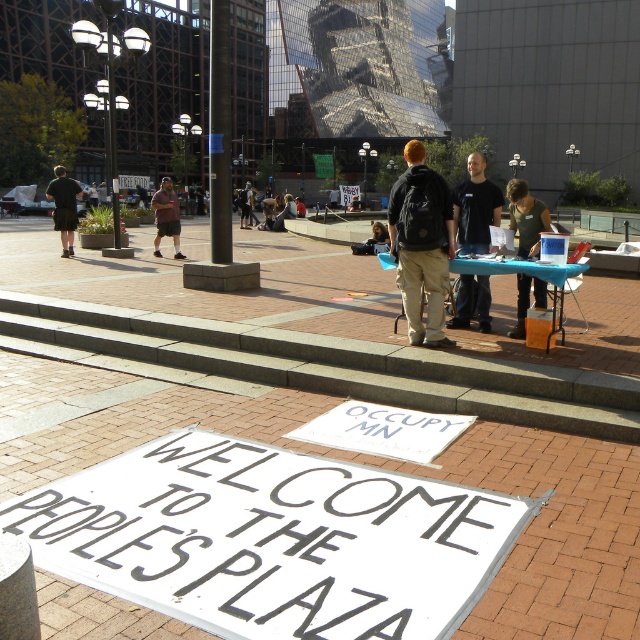
Question: Observing the image, what is the correct spatial positioning of dark brown shorts at left in reference to brown cotton shorts at center?

Choices:
 (A) right
 (B) left

Answer: (B)

Question: In this image, where is matte black backpack at center located relative to dark brown leather jacket at center?

Choices:
 (A) below
 (B) above

Answer: (A)

Question: Is white paper sign at center below matte black backpack at center?

Choices:
 (A) no
 (B) yes

Answer: (B)

Question: Which object is farther from the camera taking this photo?

Choices:
 (A) matte black backpack at center
 (B) dark brown leather jacket at center
 (C) dark brown shorts at left

Answer: (B)

Question: Which object is farther from the camera taking this photo?

Choices:
 (A) black matte t-shirt at center
 (B) matte black backpack at center
 (C) green fabric shirt at center
 (D) white paper sign at center

Answer: (A)

Question: Which point is closer to the camera?

Choices:
 (A) (413, 186)
 (B) (540, 298)

Answer: (A)